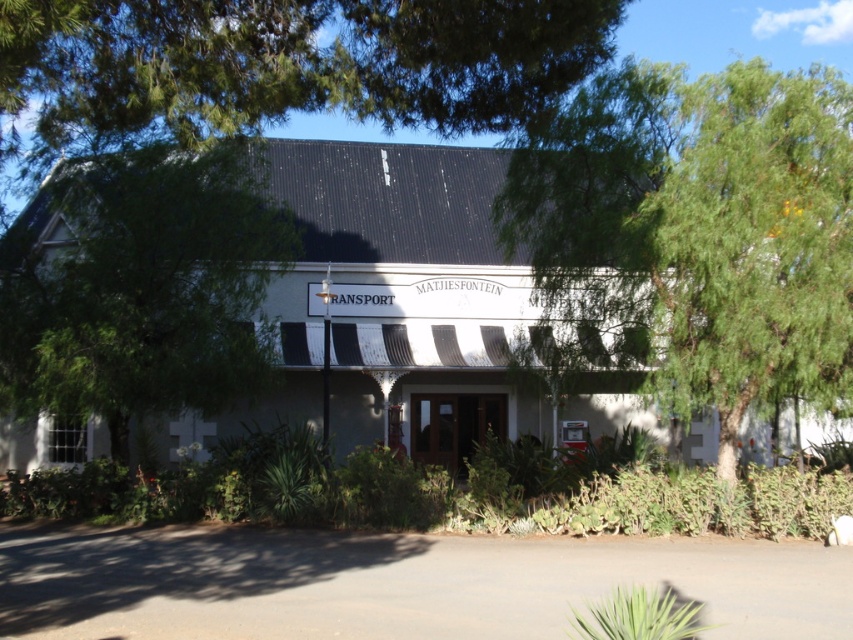
Does green leafy tree at upper right appear over green leafy tree at upper center?

Indeed, green leafy tree at upper right is positioned over green leafy tree at upper center.

Between green leafy tree at upper right and green leafy tree at upper center, which one appears on the right side from the viewer's perspective?

green leafy tree at upper right

The image size is (853, 640). I want to click on green leafy tree at upper right, so click(x=697, y=230).

At what (x,y) coordinates should I click in order to perform the action: click on green leafy tree at upper right. Please return your answer as a coordinate pair (x, y). Looking at the image, I should click on point(697,230).

Is green leafy tree at upper right wider than green leafy tree at left?

Indeed, green leafy tree at upper right has a greater width compared to green leafy tree at left.

Is green leafy tree at upper right bigger than green leafy tree at left?

Indeed, green leafy tree at upper right has a larger size compared to green leafy tree at left.

Is point (648, 248) more distant than point (105, 305)?

No, (648, 248) is in front of (105, 305).

Identify the location of green leafy tree at upper right. (697, 230).

Does green leafy tree at upper center have a greater height compared to green leafy tree at left?

Incorrect, green leafy tree at upper center's height is not larger of green leafy tree at left's.

Is point (245, 99) closer to camera compared to point (202, 380)?

Yes, it is.

The height and width of the screenshot is (640, 853). In order to click on green leafy tree at upper center in this screenshot , I will do `click(293, 61)`.

Locate an element on the screen. The height and width of the screenshot is (640, 853). green leafy tree at upper center is located at coordinates (293, 61).